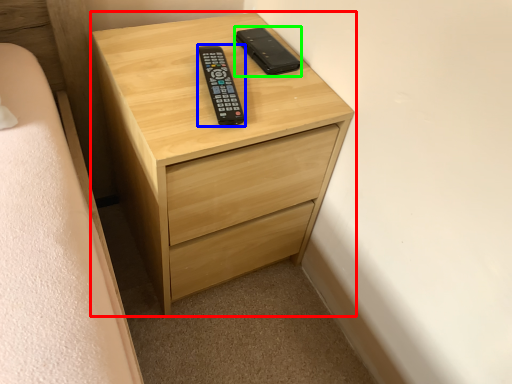
Question: Which is farther away from chest of drawers (highlighted by a red box)? control (highlighted by a blue box) or control (highlighted by a green box)?

Choices:
 (A) control
 (B) control

Answer: (B)